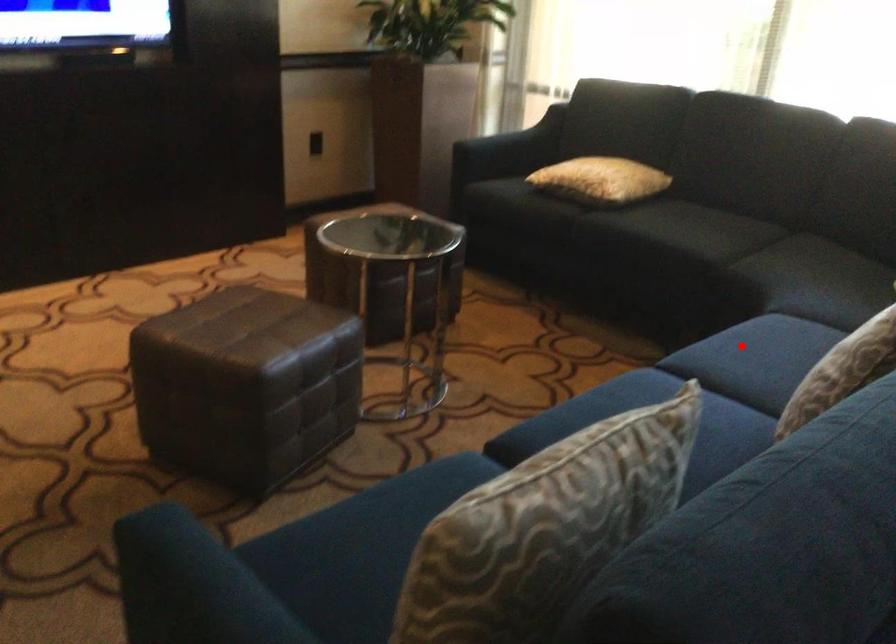
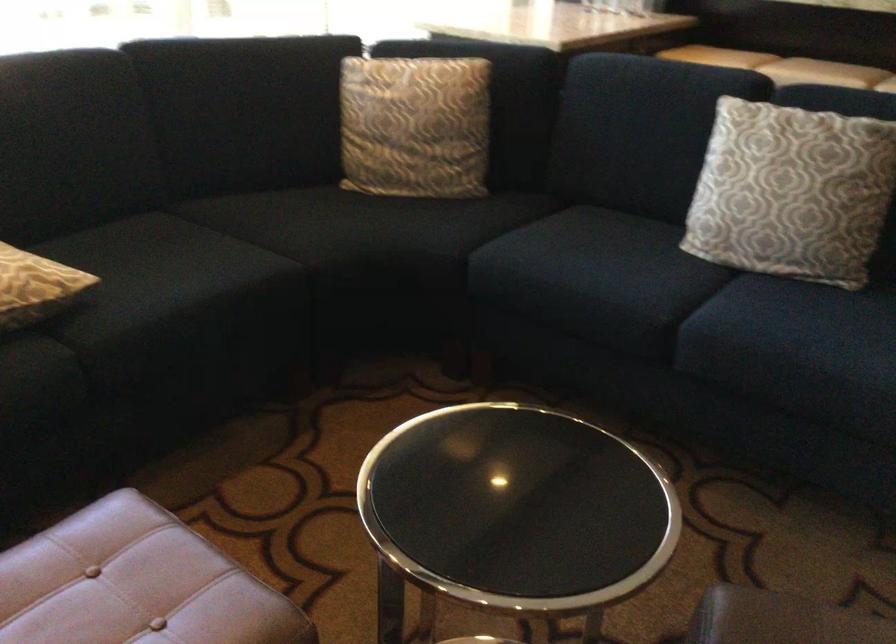
Where in the second image is the point corresponding to the highlighted location from the first image?

(590, 274)